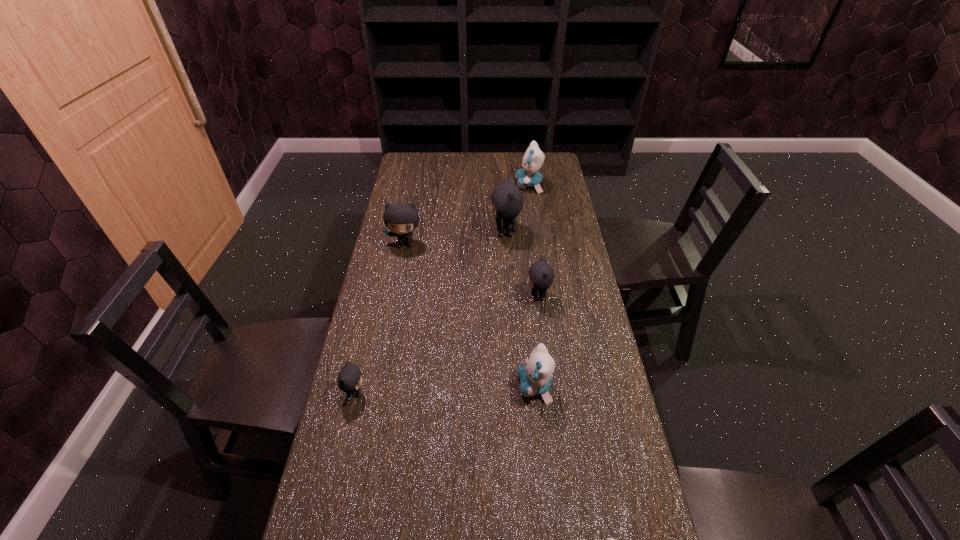
Where is `the biggest gray kitten`? The height and width of the screenshot is (540, 960). the biggest gray kitten is located at coordinates (506, 199).

Where is `the biggest blue kitten`? The width and height of the screenshot is (960, 540). the biggest blue kitten is located at coordinates (533, 158).

Find the location of a particular element. The height and width of the screenshot is (540, 960). the farthest object is located at coordinates (533, 158).

Identify the location of the second biggest gray kitten. The width and height of the screenshot is (960, 540). (400, 218).

You are a GUI agent. You are given a task and a screenshot of the screen. Output one action in this format:
    pyautogui.click(x=<x>, y=<y>)
    Task: Click on the second nearest blue kitten
    The width and height of the screenshot is (960, 540).
    Given the screenshot: What is the action you would take?
    pyautogui.click(x=535, y=377)

At what (x,y) coordinates should I click in order to perform the action: click on the third farthest gray kitten. Please return your answer as a coordinate pair (x, y). Looking at the image, I should click on (540, 275).

Locate an element on the screen. The height and width of the screenshot is (540, 960). the third biggest gray kitten is located at coordinates [540, 275].

Identify the location of the nearest gray kitten. This screenshot has width=960, height=540. (350, 377).

You are a GUI agent. You are given a task and a screenshot of the screen. Output one action in this format:
    pyautogui.click(x=<x>, y=<y>)
    Task: Click on the free space located 0.270m on the front-facing side of the biggest gray kitten
    This screenshot has height=540, width=960.
    Given the screenshot: What is the action you would take?
    (x=420, y=232)

Where is `vacant space situated 0.170m on the front-facing side of the biggest gray kitten`? Image resolution: width=960 pixels, height=540 pixels. vacant space situated 0.170m on the front-facing side of the biggest gray kitten is located at coordinates (446, 232).